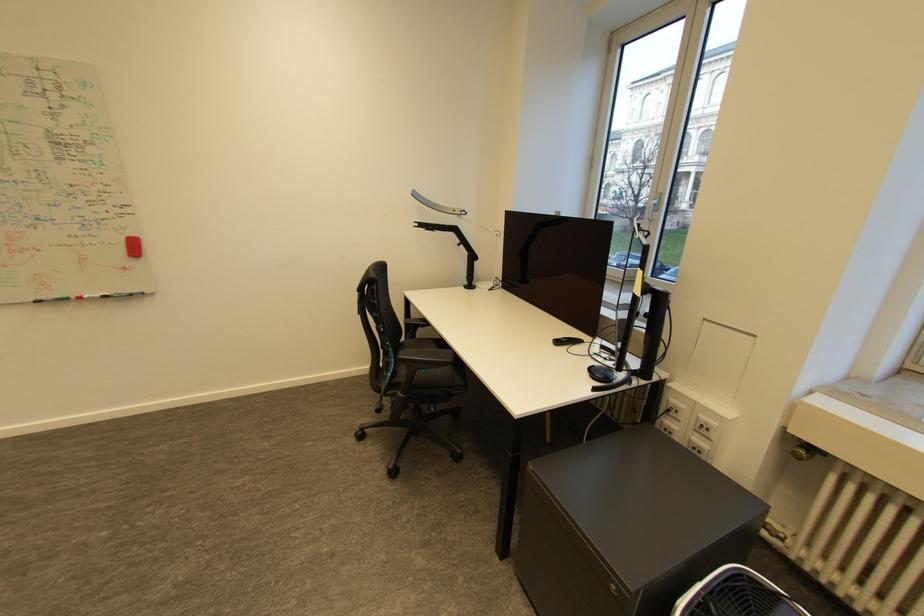
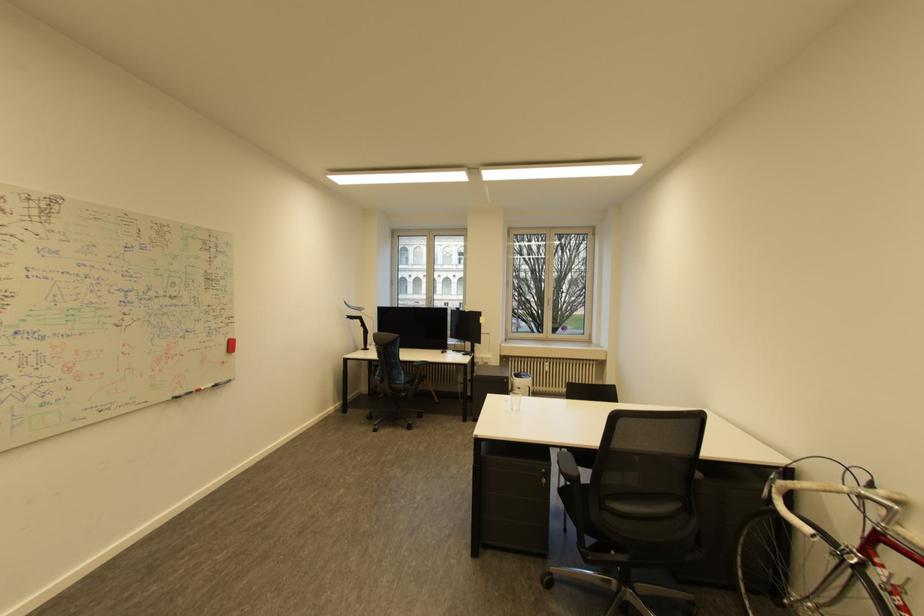
The point at (38, 301) is marked in the first image. Where is the corresponding point in the second image?

(176, 399)